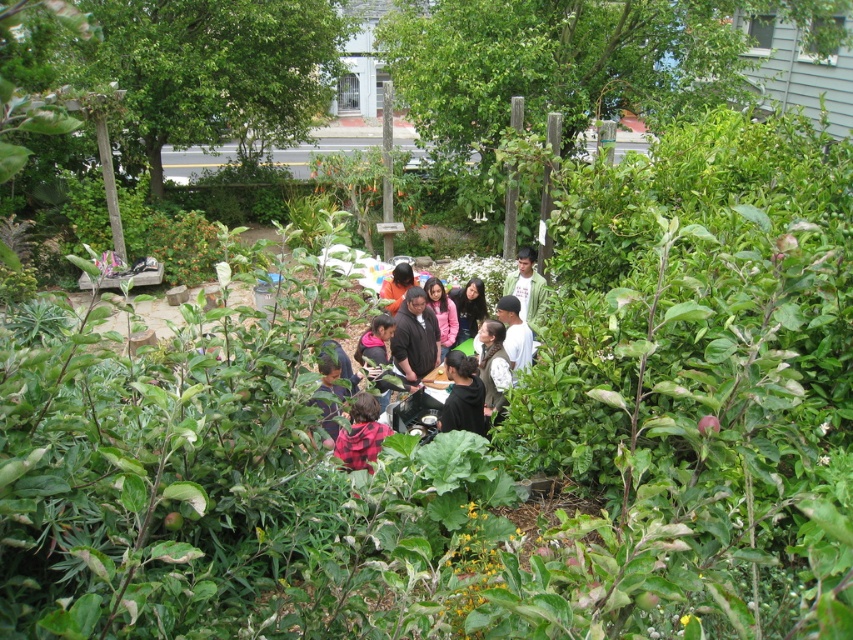
Does dark brown jacket at center have a lesser height compared to white matte shirt at center?

Yes.

Between point (490, 292) and point (508, 355), which one is positioned behind?

The point (490, 292) is behind.

Image resolution: width=853 pixels, height=640 pixels. I want to click on dark brown jacket at center, so click(x=372, y=272).

Is plaid fabric shirt at center taller than green matte jacket at center?

In fact, plaid fabric shirt at center may be shorter than green matte jacket at center.

Describe the element at coordinates (361, 433) in the screenshot. I see `plaid fabric shirt at center` at that location.

Find the location of a particular element. The image size is (853, 640). plaid fabric shirt at center is located at coordinates (361, 433).

Does point (532, 275) come farther from viewer compared to point (521, 320)?

Yes, point (532, 275) is farther from viewer.

Where is `green matte jacket at center`? The image size is (853, 640). green matte jacket at center is located at coordinates (526, 285).